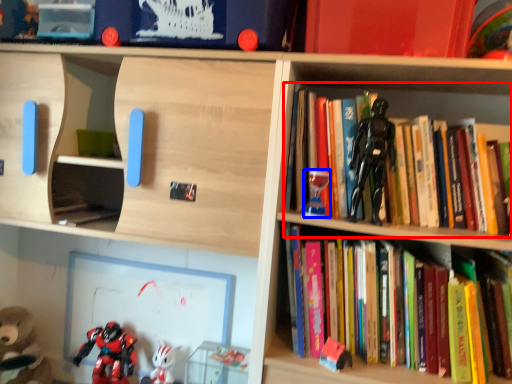
Question: Which object appears farthest to the camera in this image, book (highlighted by a red box) or toy (highlighted by a blue box)?

Choices:
 (A) book
 (B) toy

Answer: (B)